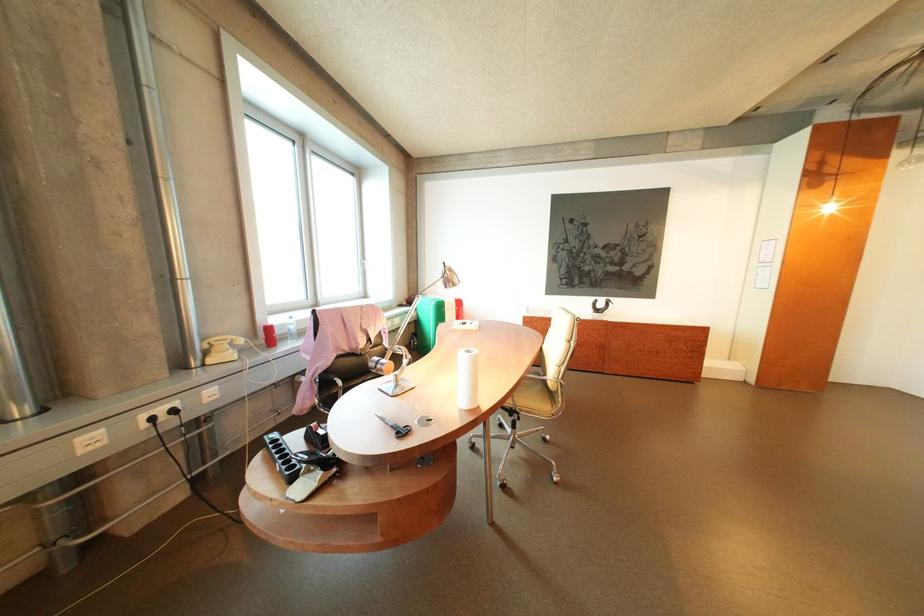
The image size is (924, 616). What do you see at coordinates (400, 430) in the screenshot? I see `the black scissors` at bounding box center [400, 430].